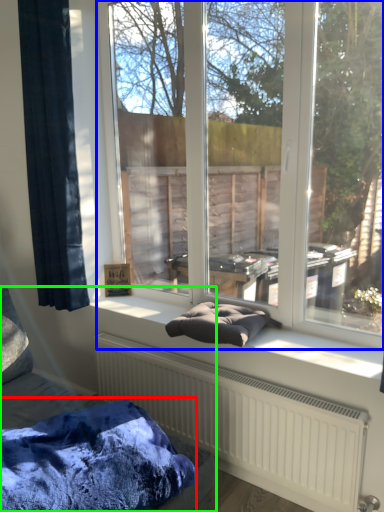
Question: Which object is the closest to the blanket (highlighted by a red box)? Choose among these: window (highlighted by a blue box) or furniture (highlighted by a green box).

Choices:
 (A) window
 (B) furniture

Answer: (B)